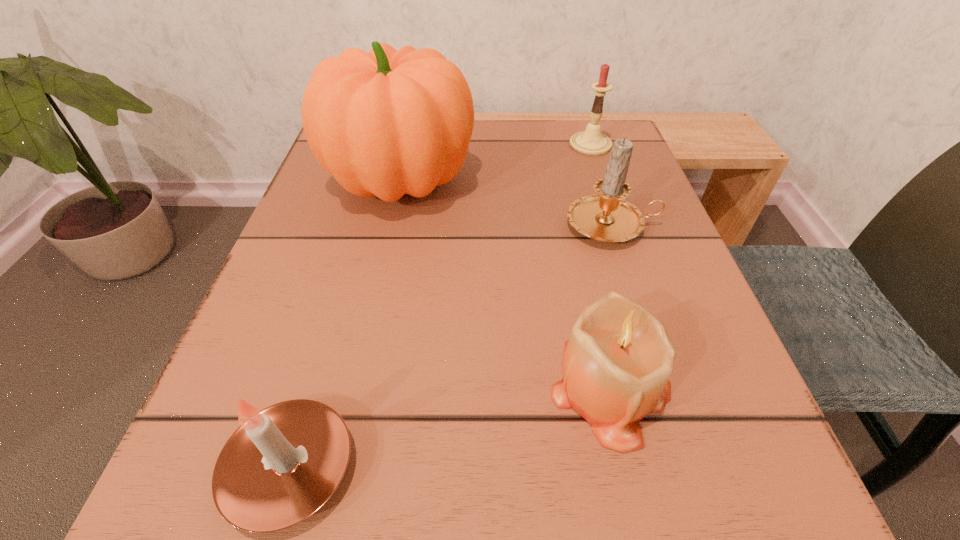
Identify the location of object that stands as the third closest to the leftmost candle. tap(606, 216).

Identify which candle is the second nearest to the farthest candle. Please provide its 2D coordinates. Your answer should be formatted as a tuple, i.e. [(x, y)], where the tuple contains the x and y coordinates of a point satisfying the conditions above.

[(616, 364)]

Select which candle is the third closest to the second farthest candle. Please provide its 2D coordinates. Your answer should be formatted as a tuple, i.e. [(x, y)], where the tuple contains the x and y coordinates of a point satisfying the conditions above.

[(283, 463)]